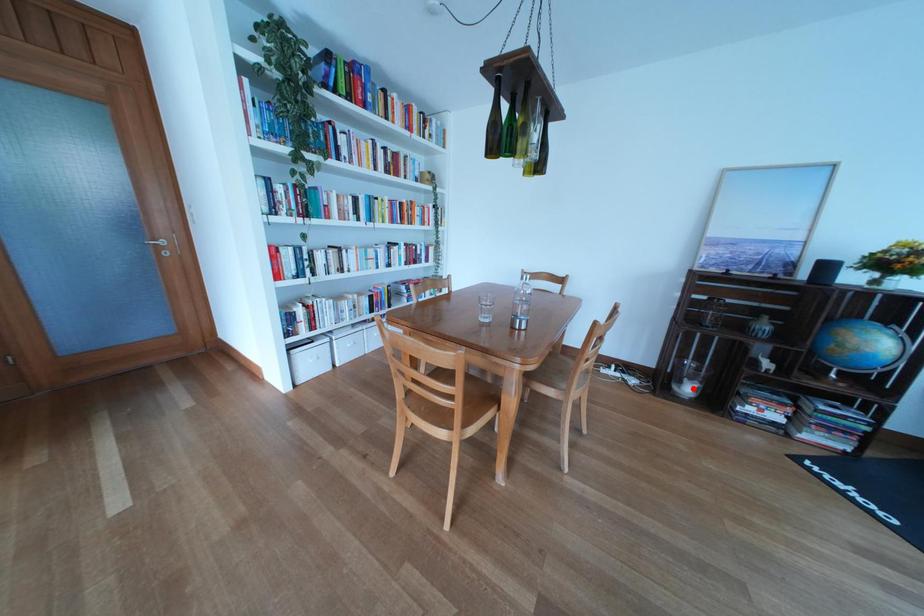
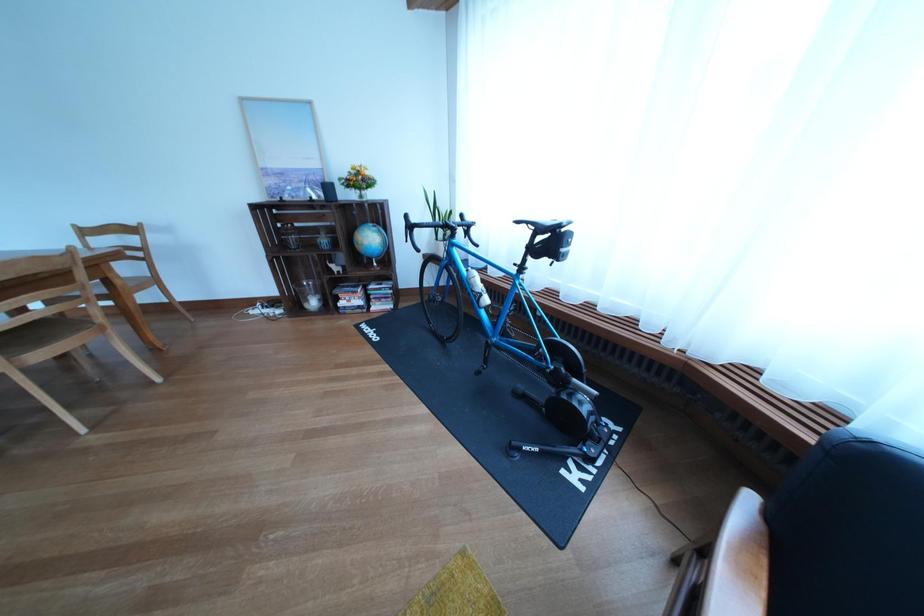
Question: I am providing you with two images of the same scene from different viewpoints. A red point is shown in image1. For the corresponding object point in image2, is it positioned nearer or farther from the camera?

Choices:
 (A) Nearer
 (B) Farther

Answer: (B)